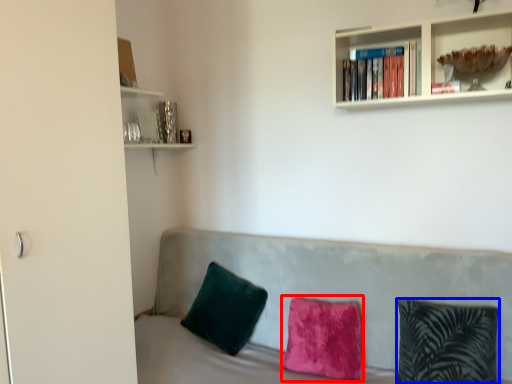
Question: Which of the following is the farthest to the observer, pillow (highlighted by a red box) or pillow (highlighted by a blue box)?

Choices:
 (A) pillow
 (B) pillow

Answer: (A)